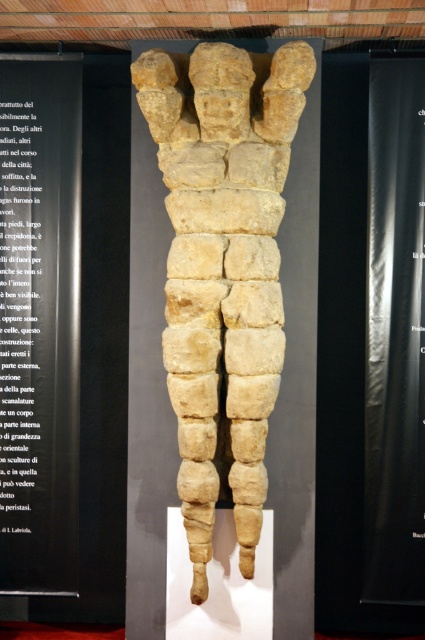
Who is positioned more to the left, black paper at left or black paper at upper left?

Positioned to the left is black paper at upper left.

Which is in front, point (44, 417) or point (31, 470)?

Point (44, 417) is in front.

The image size is (425, 640). I want to click on black paper at left, so click(x=39, y=321).

Does yellow stone statue at center have a lesser height compared to black paper at upper left?

No, yellow stone statue at center is not shorter than black paper at upper left.

Can you confirm if yellow stone statue at center is wider than black paper at upper left?

Yes, yellow stone statue at center is wider than black paper at upper left.

Who is more forward, (x=190, y=182) or (x=14, y=416)?

Point (x=190, y=182)

You are a GUI agent. You are given a task and a screenshot of the screen. Output one action in this format:
    pyautogui.click(x=<x>, y=<y>)
    Task: Click on the yellow stone statue at center
    This screenshot has width=425, height=640.
    Given the screenshot: What is the action you would take?
    (223, 268)

Is point (249, 364) closer to camera compared to point (44, 182)?

Yes, it is.

Does yellow stone statue at center have a larger size compared to black paper at left?

Indeed, yellow stone statue at center has a larger size compared to black paper at left.

At what (x,y) coordinates should I click in order to perform the action: click on yellow stone statue at center. Please return your answer as a coordinate pair (x, y). The height and width of the screenshot is (640, 425). Looking at the image, I should click on (223, 268).